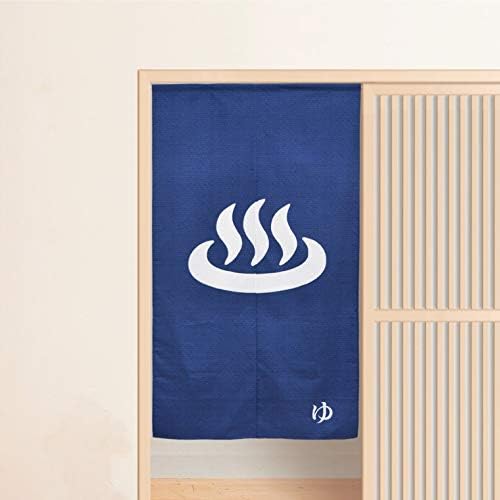
The image size is (500, 500). In order to click on panel in this screenshot , I will do `click(459, 229)`.